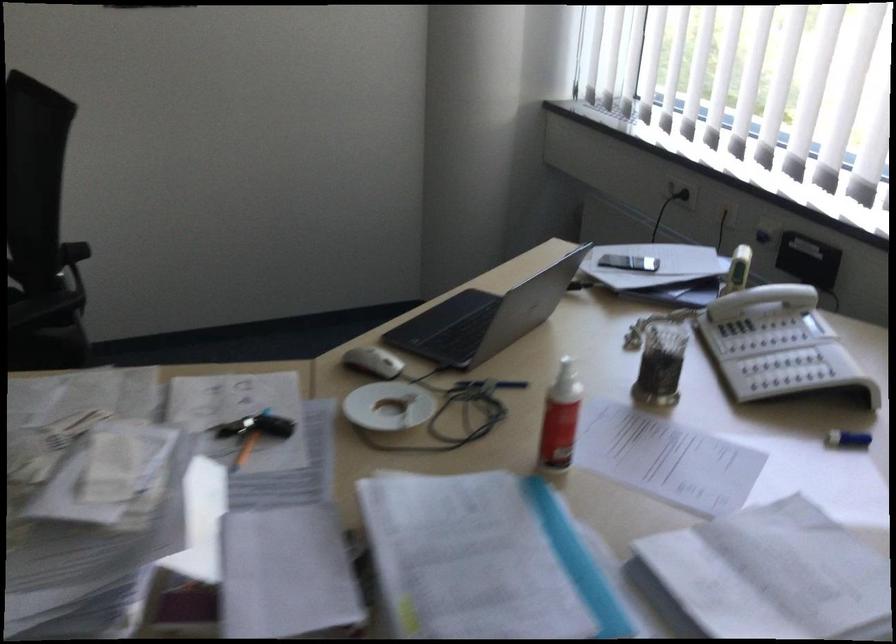
This screenshot has width=896, height=644. In order to click on blue capped pen in this screenshot , I will do `click(848, 439)`.